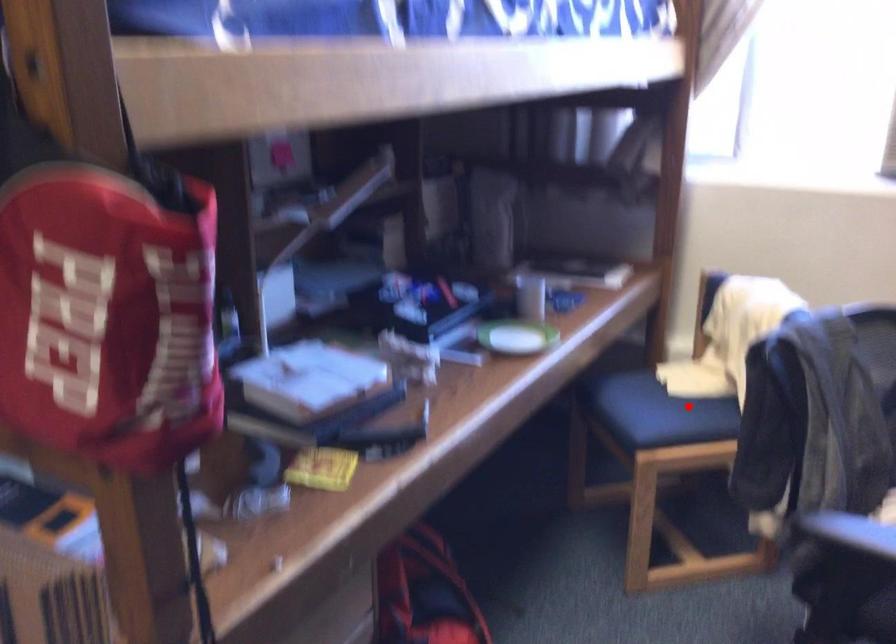
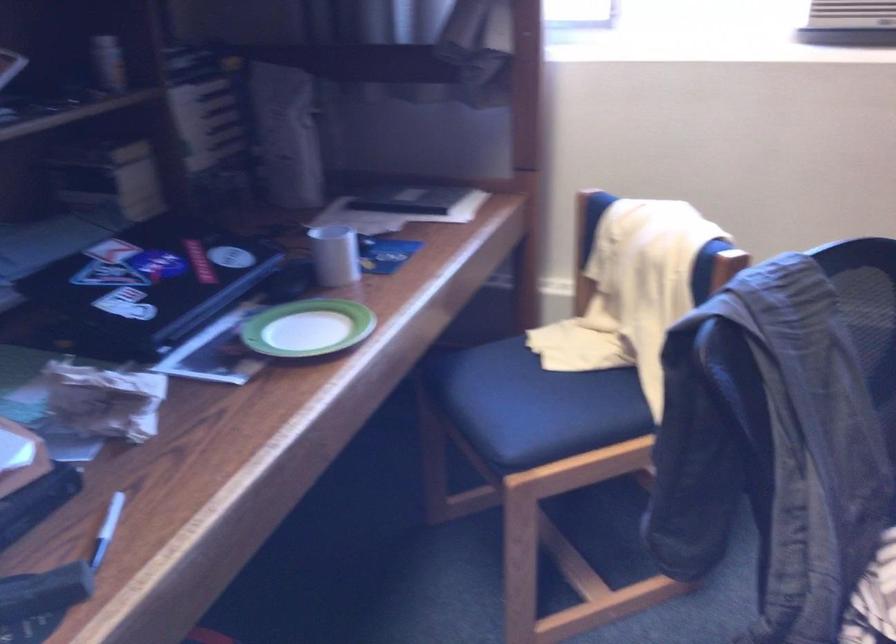
In the second image, find the point that corresponds to the highlighted location in the first image.

(576, 393)